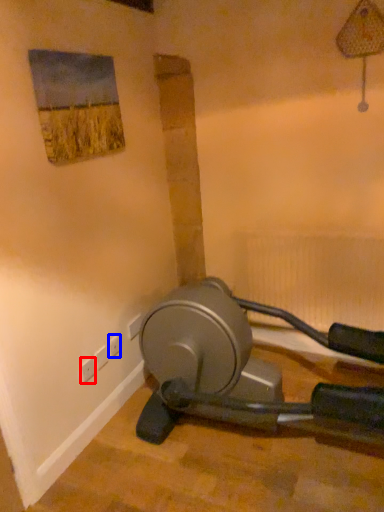
Question: Which object appears closest to the camera in this image, electric outlet (highlighted by a red box) or electric outlet (highlighted by a blue box)?

Choices:
 (A) electric outlet
 (B) electric outlet

Answer: (A)